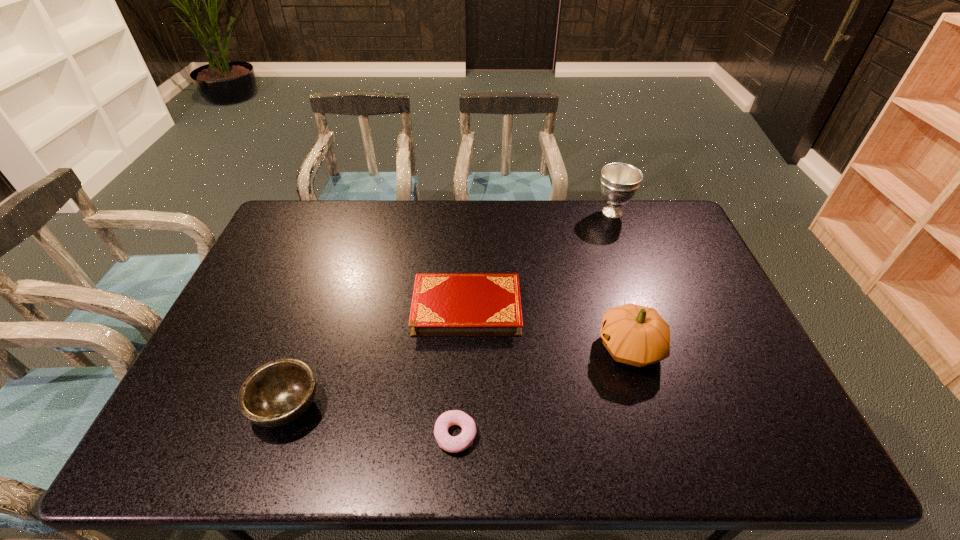
The width and height of the screenshot is (960, 540). Find the location of `vacant area in the image that satisfies the following two spatial constraints: 1. on the front side of the farthest object; 2. on the side of the gourd with the carved face`. vacant area in the image that satisfies the following two spatial constraints: 1. on the front side of the farthest object; 2. on the side of the gourd with the carved face is located at coordinates (662, 348).

At what (x,y) coordinates should I click in order to perform the action: click on free space in the image that satisfies the following two spatial constraints: 1. on the side of the gourd with the carved face; 2. on the front side of the bowl. Please return your answer as a coordinate pair (x, y). This screenshot has height=540, width=960. Looking at the image, I should click on (648, 406).

Where is `free space that satisfies the following two spatial constraints: 1. on the cover of the second shortest object; 2. on the front side of the doughnut`? free space that satisfies the following two spatial constraints: 1. on the cover of the second shortest object; 2. on the front side of the doughnut is located at coordinates (463, 435).